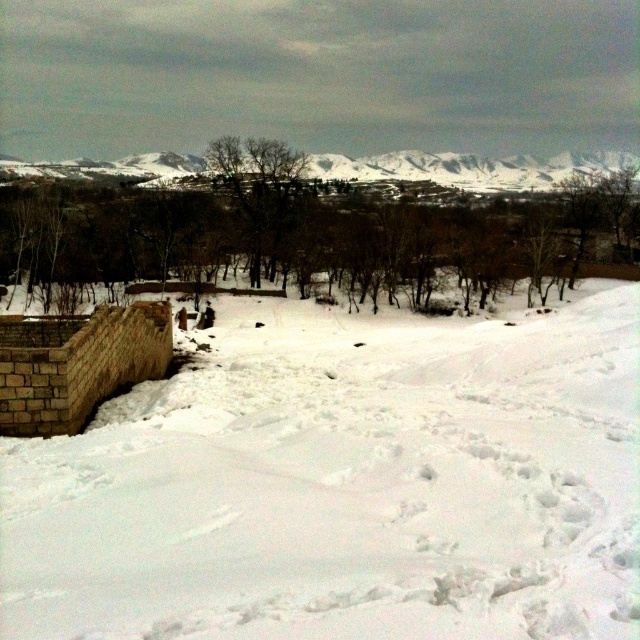
You are standing at the point marked as point (344, 483) in the winter landscape. What is the terrain like at that location?

The terrain at point (344, 483) is white powdery snow at center.

You are standing in the winter landscape and want to take a photo of the brown leafless trees at center. Since the white powdery snow at center is in the way, can you step back to get them all in the frame without the snow blocking the view?

The white powdery snow at center is closer to the viewer than the brown leafless trees at center. By stepping back, you can position yourself so that the snow is no longer blocking the trees, allowing them to be fully visible in the photo.